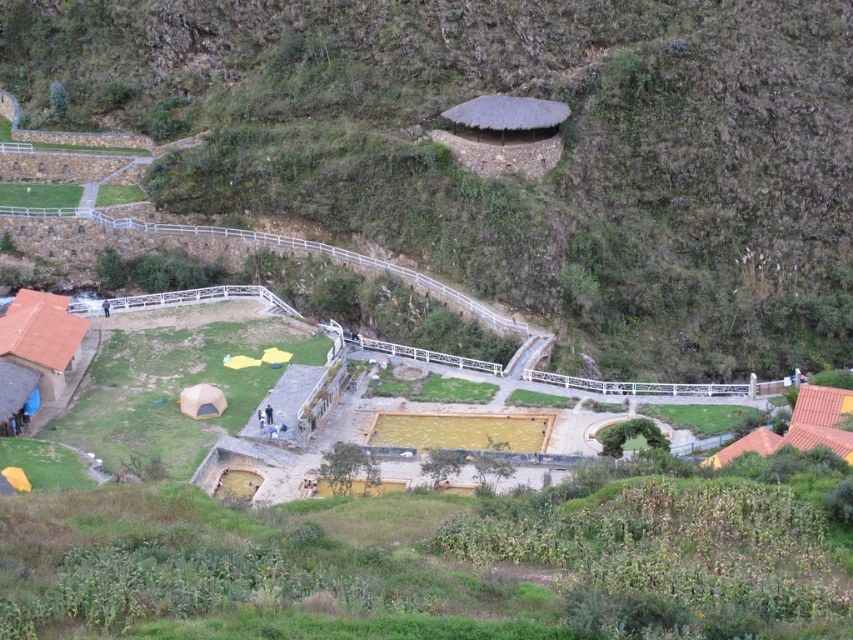
Question: Does brown thatched roof at upper center come behind terracotta clay hut at lower left?

Choices:
 (A) no
 (B) yes

Answer: (B)

Question: Which of these objects is positioned closest to the terracotta clay hut at lower left?

Choices:
 (A) brown thatched roof at upper center
 (B) thatched roof hut at upper center
 (C) matte yellow tent at lower center
 (D) orange canvas tent at lower right

Answer: (C)

Question: Is brown thatched roof at upper center positioned before thatched roof hut at upper center?

Choices:
 (A) no
 (B) yes

Answer: (B)

Question: Which point is farther from the camera taking this photo?

Choices:
 (A) (520, 256)
 (B) (521, 120)

Answer: (B)

Question: Which object appears farthest from the camera in this image?

Choices:
 (A) terracotta clay hut at lower left
 (B) thatched roof hut at upper center

Answer: (B)

Question: Is terracotta clay hut at lower left below matte yellow tent at lower center?

Choices:
 (A) yes
 (B) no

Answer: (B)